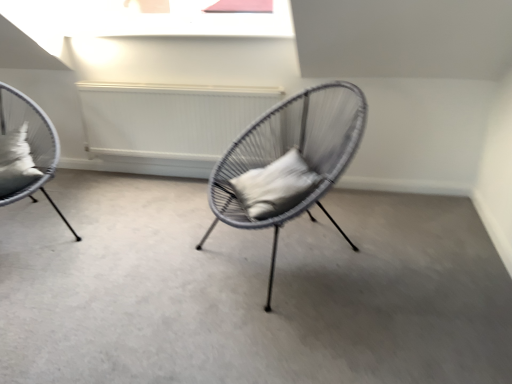
Question: Is white soft pillow at left, the second pillow from the right, turned away from matte grey wicker chair at left, the second chair viewed from the right?

Choices:
 (A) yes
 (B) no

Answer: (A)

Question: Is white soft pillow at left, which ranks as the first pillow in left-to-right order, touching matte grey wicker chair at left, the second chair viewed from the right?

Choices:
 (A) no
 (B) yes

Answer: (B)

Question: From a real-world perspective, is white soft pillow at left, which ranks as the first pillow in left-to-right order, physically above matte grey wicker chair at left, the second chair viewed from the right?

Choices:
 (A) yes
 (B) no

Answer: (A)

Question: Is white soft pillow at left, the second pillow from the right, bigger than matte grey wicker chair at left, the second chair viewed from the right?

Choices:
 (A) no
 (B) yes

Answer: (A)

Question: Does white soft pillow at left, which ranks as the first pillow in left-to-right order, turn towards matte grey wicker chair at left, the second chair viewed from the right?

Choices:
 (A) yes
 (B) no

Answer: (A)

Question: Considering the positions of matte grey wicker chair at left, the second chair viewed from the right, and white textured radiator at center in the image, is matte grey wicker chair at left, the second chair viewed from the right, wider or thinner than white textured radiator at center?

Choices:
 (A) wide
 (B) thin

Answer: (A)

Question: In the image, is matte grey wicker chair at left, the 1th chair viewed from the left, on the left side or the right side of white textured radiator at center?

Choices:
 (A) left
 (B) right

Answer: (A)

Question: From the image's perspective, is matte grey wicker chair at left, the 1th chair viewed from the left, above or below white textured radiator at center?

Choices:
 (A) above
 (B) below

Answer: (B)

Question: Considering the positions of point [x=20, y=99] and point [x=179, y=92], is point [x=20, y=99] closer or farther from the camera than point [x=179, y=92]?

Choices:
 (A) farther
 (B) closer

Answer: (B)

Question: In the image, is white soft pillow at left, which ranks as the first pillow in left-to-right order, positioned in front of or behind matte grey wicker chair at left, the second chair viewed from the right?

Choices:
 (A) behind
 (B) front

Answer: (A)

Question: Is white soft pillow at left, which ranks as the first pillow in left-to-right order, wider or thinner than matte grey wicker chair at left, the 1th chair viewed from the left?

Choices:
 (A) thin
 (B) wide

Answer: (A)

Question: Choose the correct answer: Is white soft pillow at left, the second pillow from the right, inside matte grey wicker chair at left, the second chair viewed from the right, or outside it?

Choices:
 (A) outside
 (B) inside

Answer: (B)

Question: From a real-world perspective, relative to matte grey wicker chair at left, the 1th chair viewed from the left, is white soft pillow at left, the second pillow from the right, vertically above or below?

Choices:
 (A) below
 (B) above

Answer: (B)

Question: Is woven wire chair at center, the first chair viewed from the right, taller or shorter than white soft pillow at left, which ranks as the first pillow in left-to-right order?

Choices:
 (A) short
 (B) tall

Answer: (B)

Question: From a real-world perspective, is woven wire chair at center, which is the 2th chair in left-to-right order, above or below white soft pillow at left, the second pillow from the right?

Choices:
 (A) above
 (B) below

Answer: (B)